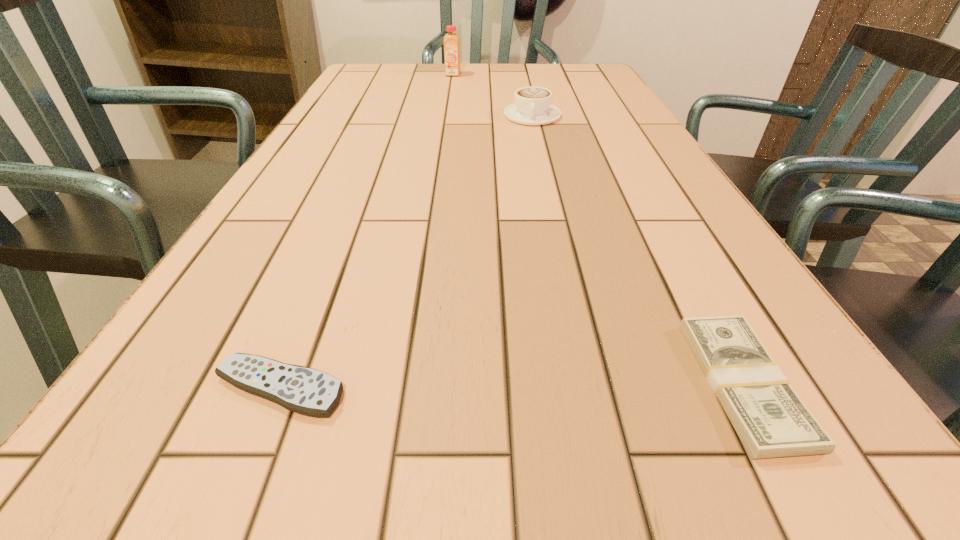
At what (x,y) coordinates should I click in order to perform the action: click on object located in the far edge section of the desktop. Please return your answer as a coordinate pair (x, y). The height and width of the screenshot is (540, 960). Looking at the image, I should click on (451, 41).

Where is `object that is at the left edge`? object that is at the left edge is located at coordinates (308, 391).

I want to click on object that is at the right edge, so click(x=771, y=420).

Locate an element on the screen. vacant space at the far edge of the desktop is located at coordinates (481, 68).

This screenshot has width=960, height=540. What are the coordinates of `free spot at the near edge of the desktop` in the screenshot? It's located at (418, 493).

Image resolution: width=960 pixels, height=540 pixels. In the image, there is a desktop. Find the location of `vacant space at the left edge`. vacant space at the left edge is located at coordinates (382, 109).

Find the location of a particular element. The width and height of the screenshot is (960, 540). free region at the right edge of the desktop is located at coordinates tap(604, 137).

In the image, there is a desktop. Where is `vacant space at the near left corner`? Image resolution: width=960 pixels, height=540 pixels. vacant space at the near left corner is located at coordinates (200, 520).

At what (x,y) coordinates should I click in order to perform the action: click on free space at the far right corner of the desktop. Please return your answer as a coordinate pair (x, y). Looking at the image, I should click on (592, 80).

Where is `free space between the third shortest object and the tallest object`? The image size is (960, 540). free space between the third shortest object and the tallest object is located at coordinates (492, 95).